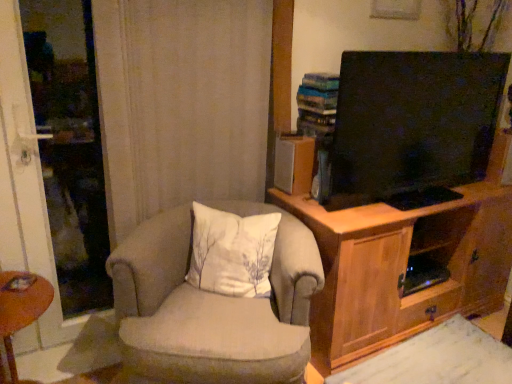
Question: Is beige fabric chair at center wider or thinner than brown wooden desk at lower left?

Choices:
 (A) thin
 (B) wide

Answer: (B)

Question: From the image's perspective, relative to brown wooden desk at lower left, is beige fabric chair at center above or below?

Choices:
 (A) above
 (B) below

Answer: (A)

Question: Considering the real-world distances, which object is farthest from the wooden cabinet at right?

Choices:
 (A) brown wooden desk at lower left
 (B) white fabric pillow at center
 (C) beige fabric chair at center

Answer: (A)

Question: Which object is the closest to the brown wooden desk at lower left?

Choices:
 (A) white fabric pillow at center
 (B) beige fabric chair at center
 (C) wooden cabinet at right

Answer: (B)